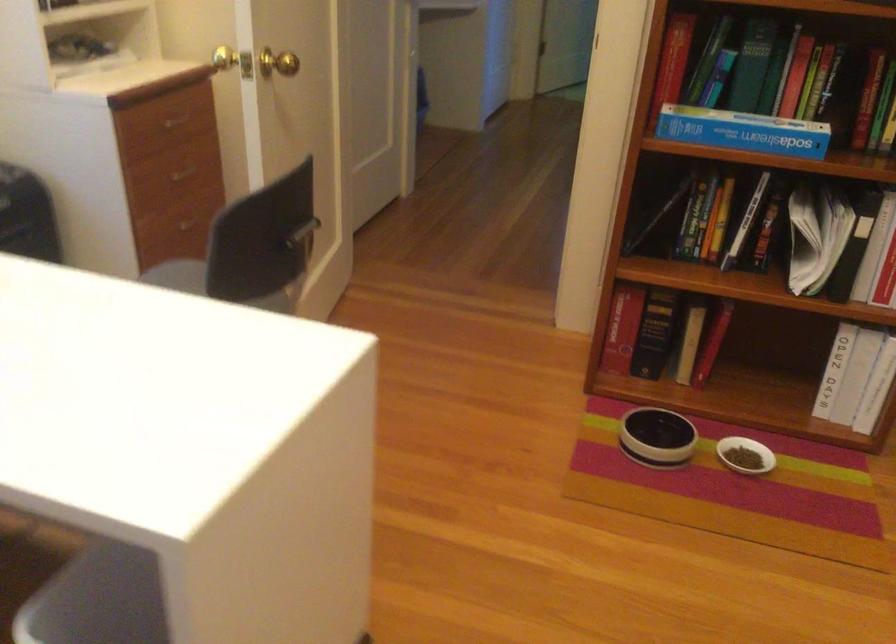
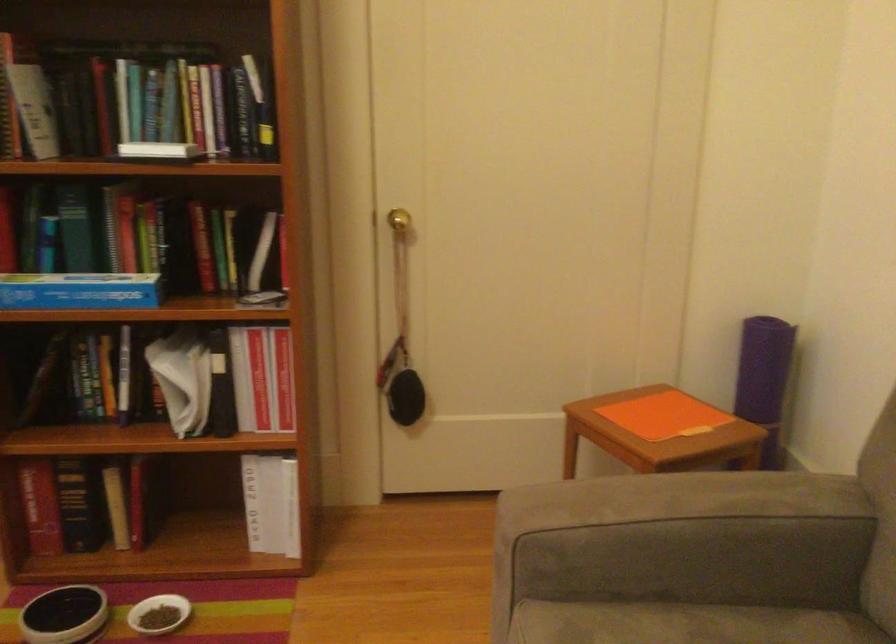
Question: The images are taken continuously from a first-person perspective. In which direction is your viewpoint rotating?

Choices:
 (A) Left
 (B) Right
 (C) Up
 (D) Down

Answer: (B)